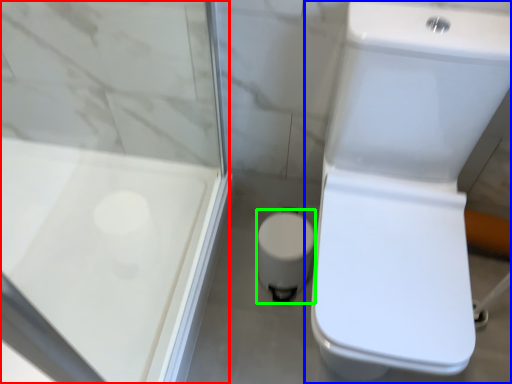
Question: Estimate the real-world distances between objects in this image. Which object is closer to screen door (highlighted by a red box), toilet (highlighted by a blue box) or porcelain (highlighted by a green box)?

Choices:
 (A) toilet
 (B) porcelain

Answer: (B)